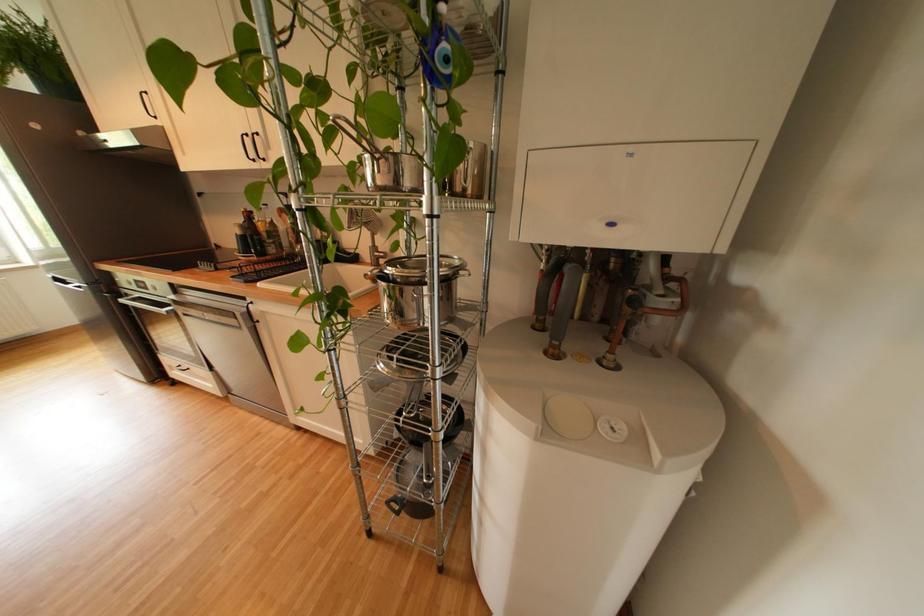
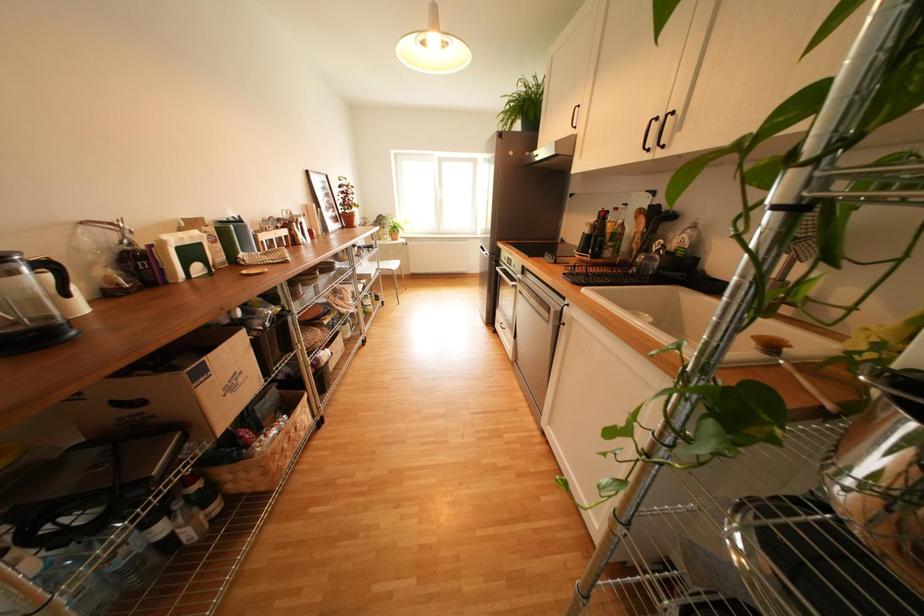
Question: How did the camera likely rotate?

Choices:
 (A) Left
 (B) Right
 (C) Up
 (D) Down

Answer: (A)